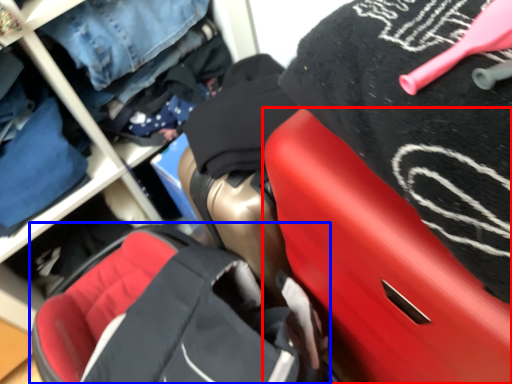
Question: Among these objects, which one is nearest to the camera, luggage (highlighted by a red box) or baby carriage (highlighted by a blue box)?

Choices:
 (A) luggage
 (B) baby carriage

Answer: (A)